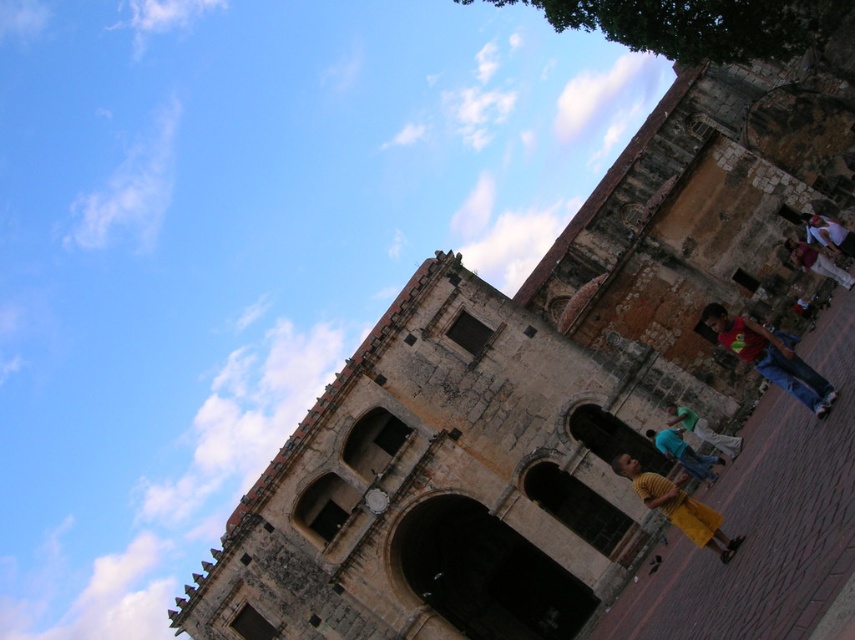
Can you confirm if yellow matte skirt at lower right is wider than green fabric shirt at center?

Incorrect, yellow matte skirt at lower right's width does not surpass green fabric shirt at center's.

From the picture: Is yellow matte skirt at lower right positioned before green fabric shirt at center?

No, it is behind green fabric shirt at center.

Is point (653, 440) less distant than point (702, 429)?

No, it is behind (702, 429).

The height and width of the screenshot is (640, 855). I want to click on yellow matte skirt at lower right, so click(x=684, y=452).

Does yellow matte skirt at lower right come in front of light brown leather jacket at right?

That is True.

Between yellow matte skirt at lower right and light brown leather jacket at right, which one appears on the left side from the viewer's perspective?

From the viewer's perspective, yellow matte skirt at lower right appears more on the left side.

Does point (684, 460) come farther from viewer compared to point (793, 244)?

No, it is not.

In order to click on yellow matte skirt at lower right in this screenshot , I will do `click(684, 452)`.

Can you confirm if red cotton shirt at right is positioned to the left of yellow cotton shirt at center?

In fact, red cotton shirt at right is to the right of yellow cotton shirt at center.

Who is lower down, red cotton shirt at right or yellow cotton shirt at center?

Positioned lower is yellow cotton shirt at center.

Image resolution: width=855 pixels, height=640 pixels. Find the location of `red cotton shirt at right`. red cotton shirt at right is located at coordinates (770, 356).

Where is `red cotton shirt at right`? This screenshot has height=640, width=855. red cotton shirt at right is located at coordinates (770, 356).